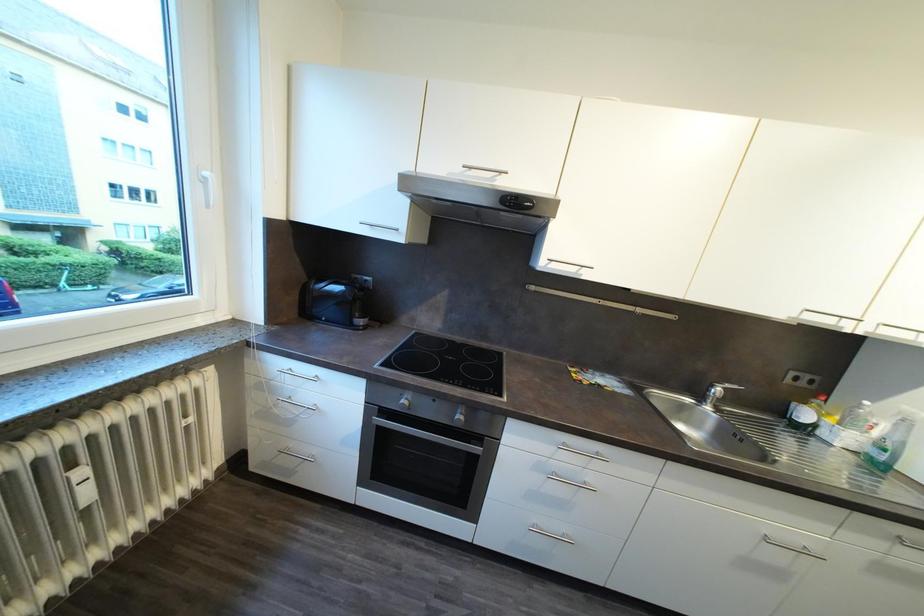
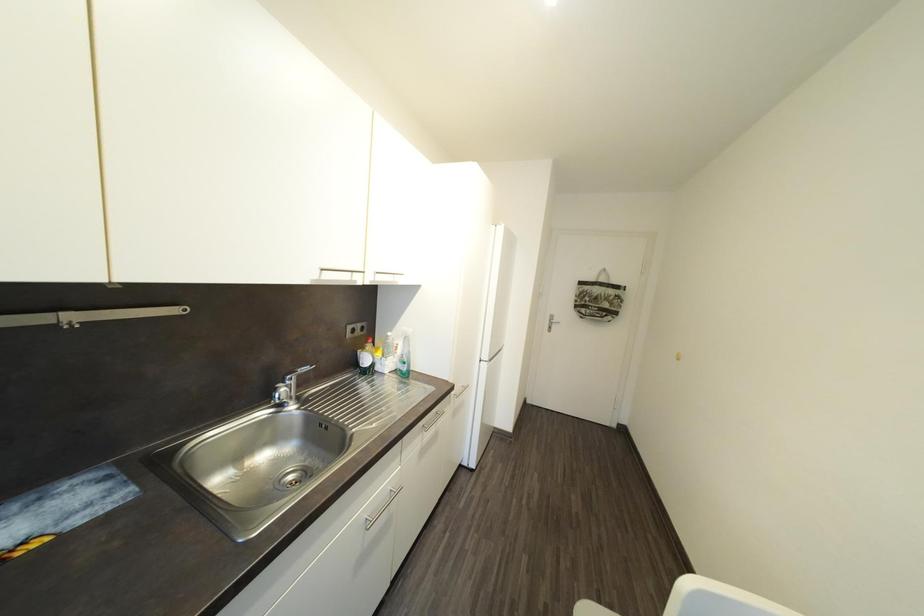
Question: The images are taken continuously from a first-person perspective. In which direction is your viewpoint rotating?

Choices:
 (A) Left
 (B) Right
 (C) Up
 (D) Down

Answer: (B)